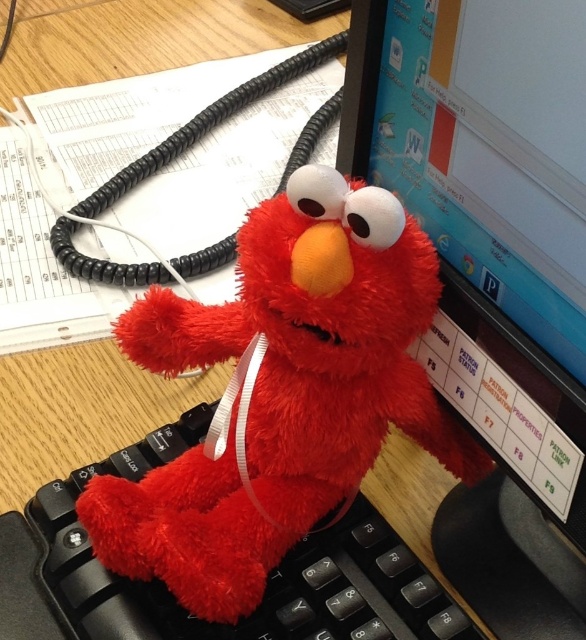
You are organizing a desk and need to place the fluffy red plush toy at center and the black plastic keyboard at center. Since space is limited, which item should you prioritize keeping if you can only save one based on their sizes?

The fluffy red plush toy at center is bigger than the black plastic keyboard at center, so you should prioritize keeping the fluffy red plush toy at center because it takes up more space and might be harder to replace or reposition.

You are a customer service representative who needs to check the screen of the matte plastic monitor at upper right but there is a fluffy red plush toy at center in the way. Can you move the toy to access the monitor?

The matte plastic monitor at upper right is in front of the fluffy red plush toy at center, so you can move the fluffy red plush toy at center aside to access the matte plastic monitor at upper right.